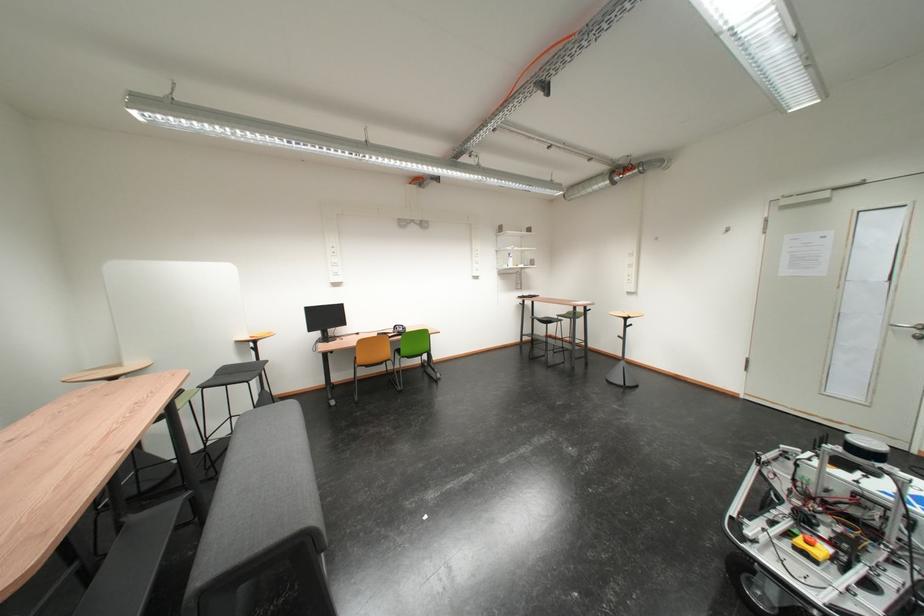
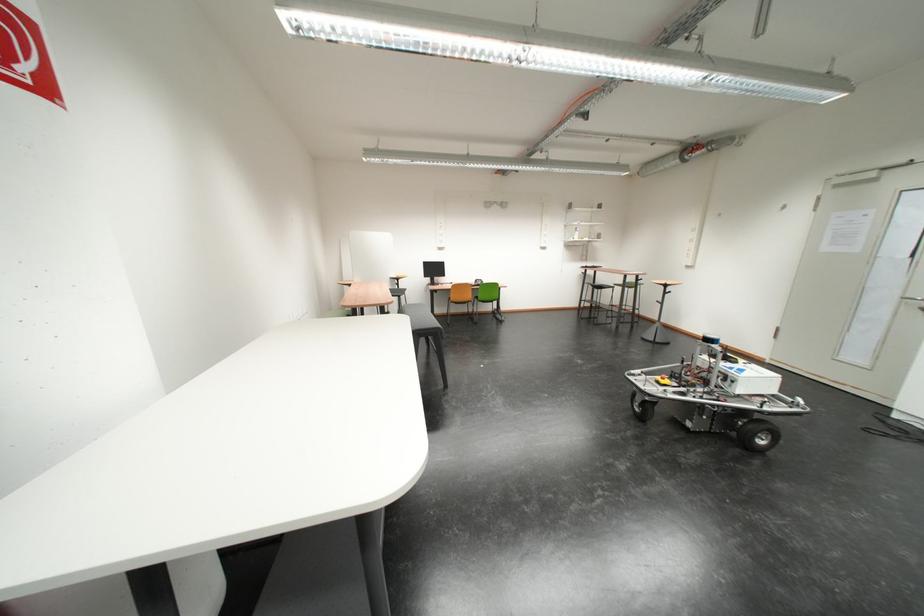
Question: The images are taken continuously from a first-person perspective. In which direction are you moving?

Choices:
 (A) Left
 (B) Right
 (C) Forward
 (D) Backward

Answer: (D)